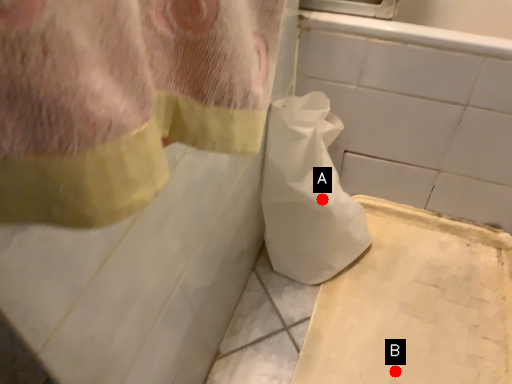
Question: Two points are circled on the image, labeled by A and B beside each circle. Which point is closer to the camera taking this photo?

Choices:
 (A) A is closer
 (B) B is closer

Answer: (B)